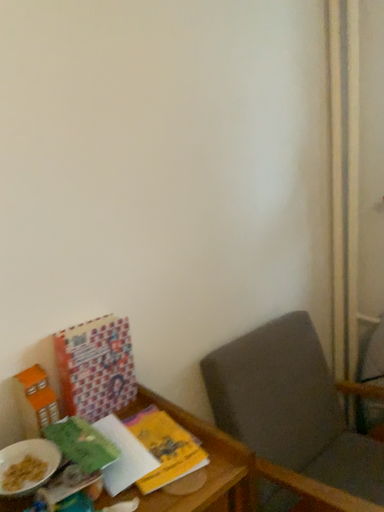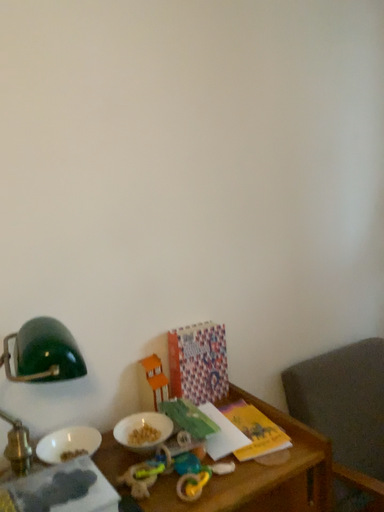
Question: How did the camera likely rotate when shooting the video?

Choices:
 (A) rotated right
 (B) rotated left

Answer: (B)